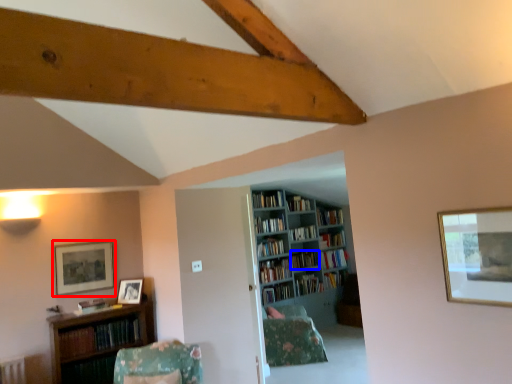
Question: Which point is closer to the camera, picture frame (highlighted by a red box) or book (highlighted by a blue box)?

Choices:
 (A) picture frame
 (B) book

Answer: (A)